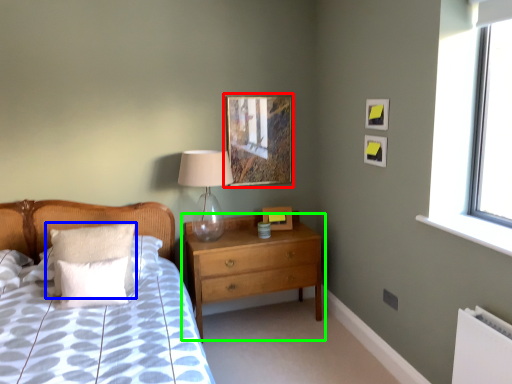
Question: Which object is the closest to the picture frame (highlighted by a red box)? Choose among these: pillow (highlighted by a blue box) or chest of drawers (highlighted by a green box).

Choices:
 (A) pillow
 (B) chest of drawers

Answer: (B)